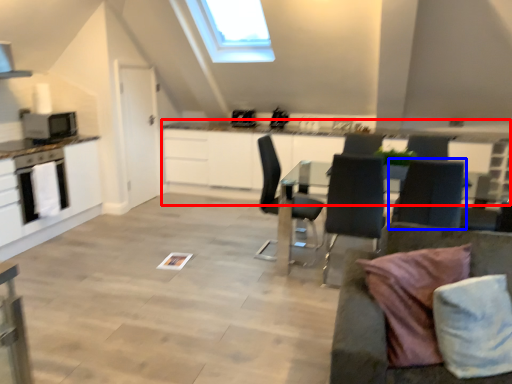
Question: Which point is closer to the camera, counter (highlighted by a red box) or chair (highlighted by a blue box)?

Choices:
 (A) counter
 (B) chair

Answer: (B)